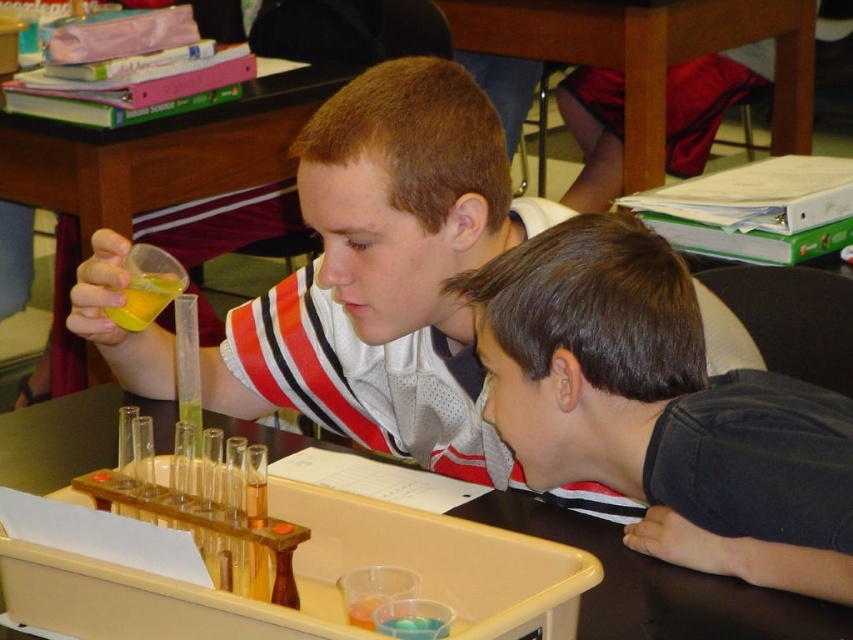
Based on the photo, which is below, matte plastic test tube at center or wooden tray at center?

Positioned lower is wooden tray at center.

Image resolution: width=853 pixels, height=640 pixels. Identify the location of matte plastic test tube at center. 387,275.

Measure the distance from dark gray shirt at lower right to translucent plastic test tube at upper center.

The distance of dark gray shirt at lower right from translucent plastic test tube at upper center is 5.73 feet.

Is dark gray shirt at lower right positioned at the back of translucent plastic test tube at upper center?

No, it is in front of translucent plastic test tube at upper center.

Does point (665, 250) come closer to viewer compared to point (177, 221)?

Yes, point (665, 250) is closer to viewer.

What are the coordinates of `dark gray shirt at lower right` in the screenshot? It's located at (660, 410).

Who is more distant from viewer, (453, 323) or (61, 216)?

Positioned behind is point (61, 216).

Does matte plastic test tube at center lie behind translucent plastic test tube at upper center?

No, matte plastic test tube at center is in front of translucent plastic test tube at upper center.

Which is in front, point (369, 266) or point (207, 132)?

Point (369, 266) is in front.

This screenshot has height=640, width=853. Identify the location of matte plastic test tube at center. (387, 275).